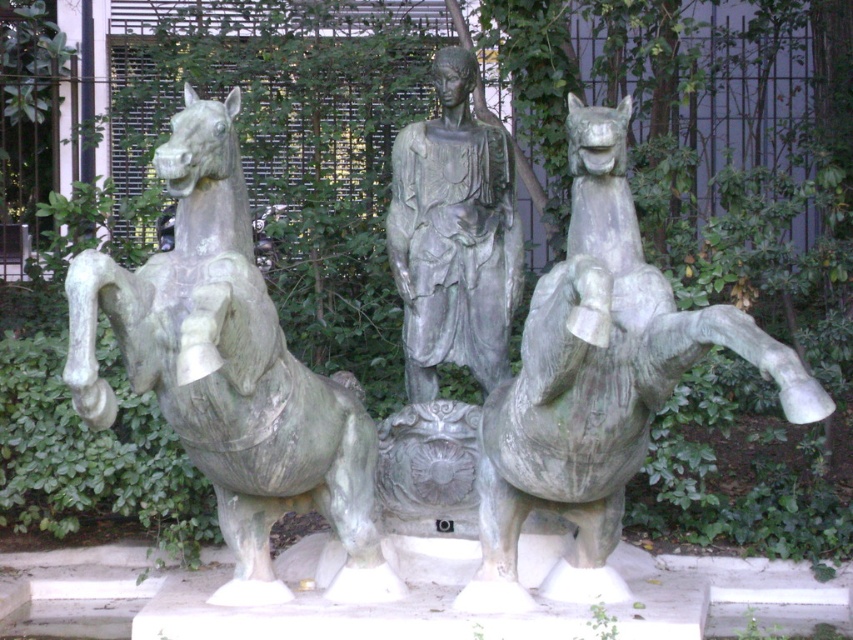
Is green patina horse at center taller than gray stone statue at center?

Indeed, green patina horse at center has a greater height compared to gray stone statue at center.

Is green patina horse at center wider than gray stone statue at center?

Indeed, green patina horse at center has a greater width compared to gray stone statue at center.

Describe the element at coordinates (596, 381) in the screenshot. I see `green patina horse at center` at that location.

The width and height of the screenshot is (853, 640). In order to click on green patina horse at center in this screenshot , I will do `click(596, 381)`.

Which is in front, point (202, 193) or point (438, 49)?

Positioned in front is point (202, 193).

Based on the photo, is green patina horse at left shorter than gray stone statue at center?

No.

I want to click on green patina horse at left, so click(x=230, y=371).

Which is behind, point (202, 218) or point (611, 291)?

The point (202, 218) is behind.

Does green patina horse at left have a larger size compared to green patina horse at center?

Yes.

Is point (276, 456) positioned behind point (570, 106)?

That is False.

The height and width of the screenshot is (640, 853). I want to click on green patina horse at left, so tap(230, 371).